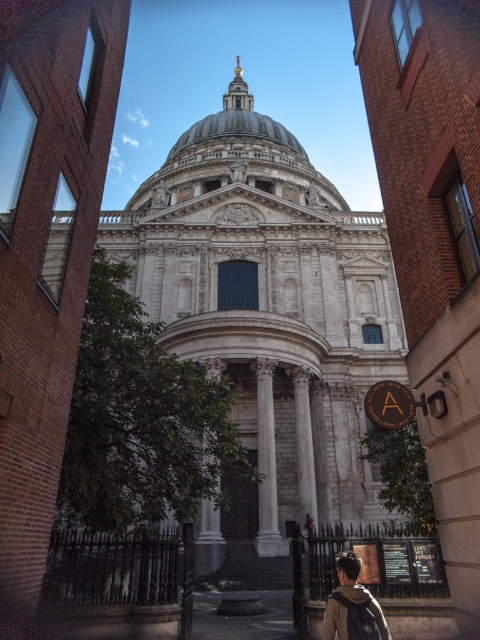
Who is lower down, white marble church at center or white marble dome at center?

white marble church at center is lower down.

Which is in front, point (280, 424) or point (327, 186)?

Point (280, 424)

You are a GUI agent. You are given a task and a screenshot of the screen. Output one action in this format:
    pyautogui.click(x=<x>, y=<y>)
    Task: Click on the white marble church at center
    The image size is (480, 640).
    Given the screenshot: What is the action you would take?
    pyautogui.click(x=267, y=316)

Where is `white marble church at center`? The height and width of the screenshot is (640, 480). white marble church at center is located at coordinates (267, 316).

Does white marble church at center have a greater height compared to dark brown leather backpack at lower right?

Correct, white marble church at center is much taller as dark brown leather backpack at lower right.

Does point (285, 314) come behind point (342, 611)?

Yes.

The width and height of the screenshot is (480, 640). What are the coordinates of `white marble church at center` in the screenshot? It's located at (267, 316).

Between white marble dome at center and dark brown leather backpack at lower right, which one appears on the right side from the viewer's perspective?

dark brown leather backpack at lower right is more to the right.

Is white marble dome at center wider than dark brown leather backpack at lower right?

Indeed, white marble dome at center has a greater width compared to dark brown leather backpack at lower right.

Is point (260, 188) farther from viewer compared to point (337, 592)?

That is True.

Find the location of `white marble dome at center`. white marble dome at center is located at coordinates (237, 148).